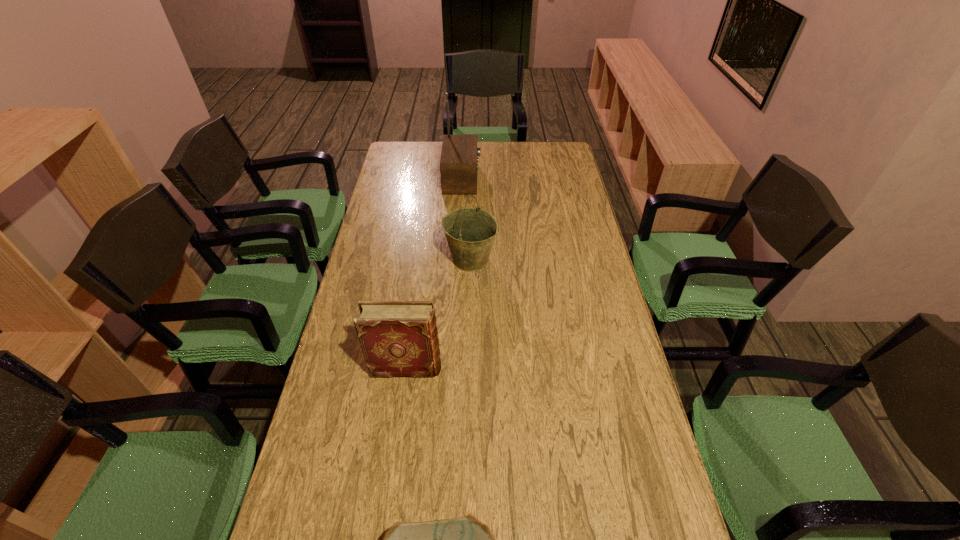
Image resolution: width=960 pixels, height=540 pixels. In order to click on the tallest object in this screenshot , I will do `click(458, 164)`.

Where is `the farthest object`? the farthest object is located at coordinates (458, 164).

Identify the location of the third nearest object. The image size is (960, 540). tap(470, 232).

You are a GUI agent. You are given a task and a screenshot of the screen. Output one action in this format:
    pyautogui.click(x=<x>, y=<y>)
    Task: Click on the hardback book
    The width and height of the screenshot is (960, 540).
    Given the screenshot: What is the action you would take?
    coord(398,338)

Locate an element on the screen. Image resolution: width=960 pixels, height=540 pixels. vacant area situated 0.240m on the front-facing side of the radio receiver is located at coordinates (535, 179).

Identify the location of free space located 0.290m on the right of the wine bucket. (578, 260).

Identify the location of vacant space situated 0.260m on the spine side of the hardback book. (534, 368).

The height and width of the screenshot is (540, 960). In order to click on object present at the far edge in this screenshot , I will do `click(458, 164)`.

This screenshot has width=960, height=540. I want to click on object situated at the left edge, so click(398, 338).

You are a GUI agent. You are given a task and a screenshot of the screen. Output one action in this format:
    pyautogui.click(x=<x>, y=<y>)
    Task: Click on the vacant space at the left edge of the desktop
    The image size is (960, 540).
    Given the screenshot: What is the action you would take?
    pyautogui.click(x=367, y=389)